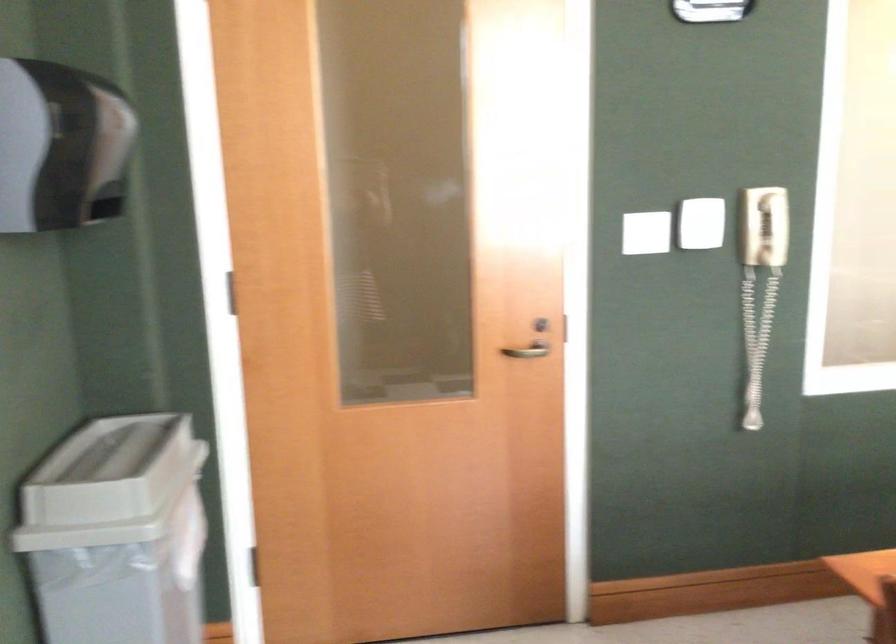
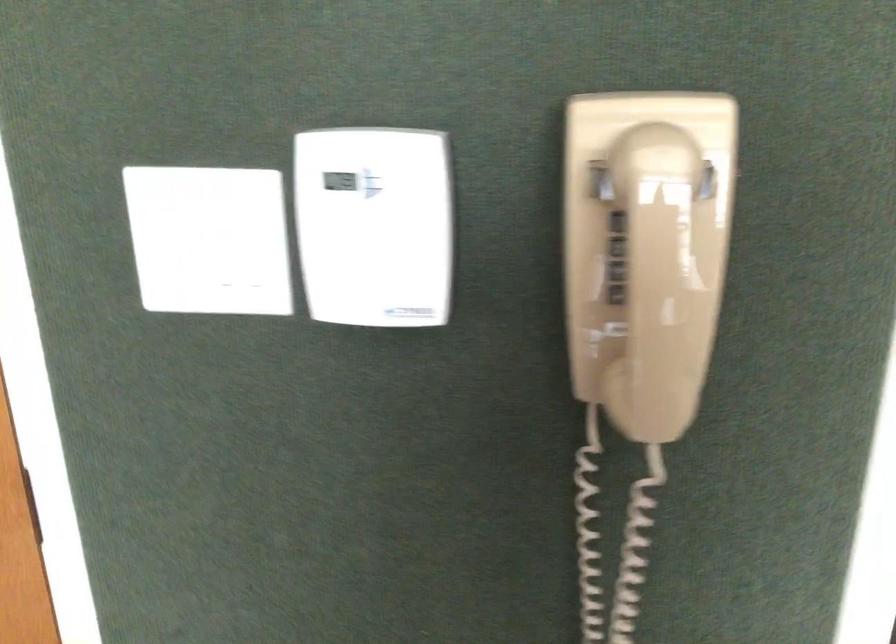
What movement of the cameraman would produce the second image?

The cameraman moved toward right, forward.